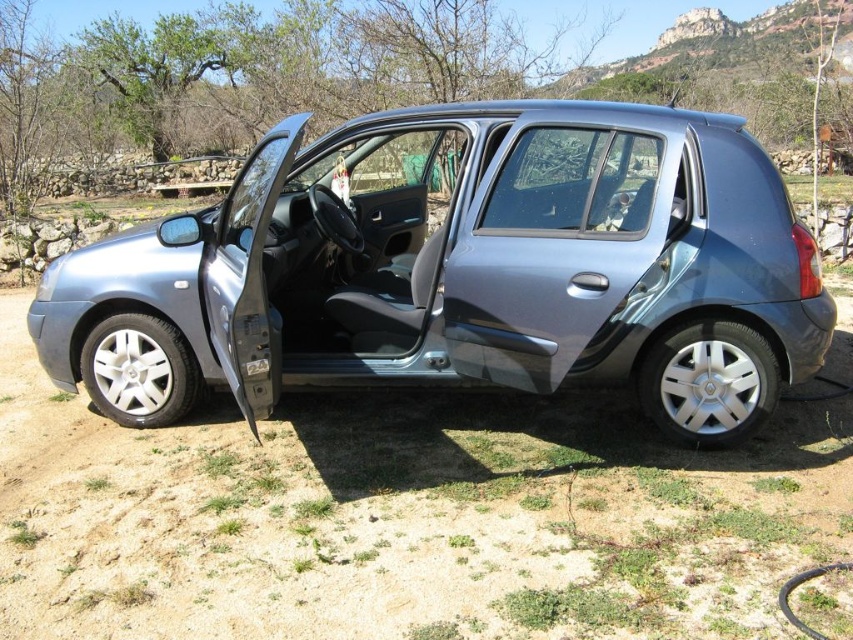
Consider the image. Who is lower down, satin metallic car at center or satin metallic car door at center?

satin metallic car door at center

Where is `satin metallic car at center`? This screenshot has width=853, height=640. satin metallic car at center is located at coordinates (461, 268).

Between point (450, 129) and point (642, 260), which one is positioned behind?

The point (450, 129) is more distant.

Identify the location of satin metallic car at center. Image resolution: width=853 pixels, height=640 pixels. (461, 268).